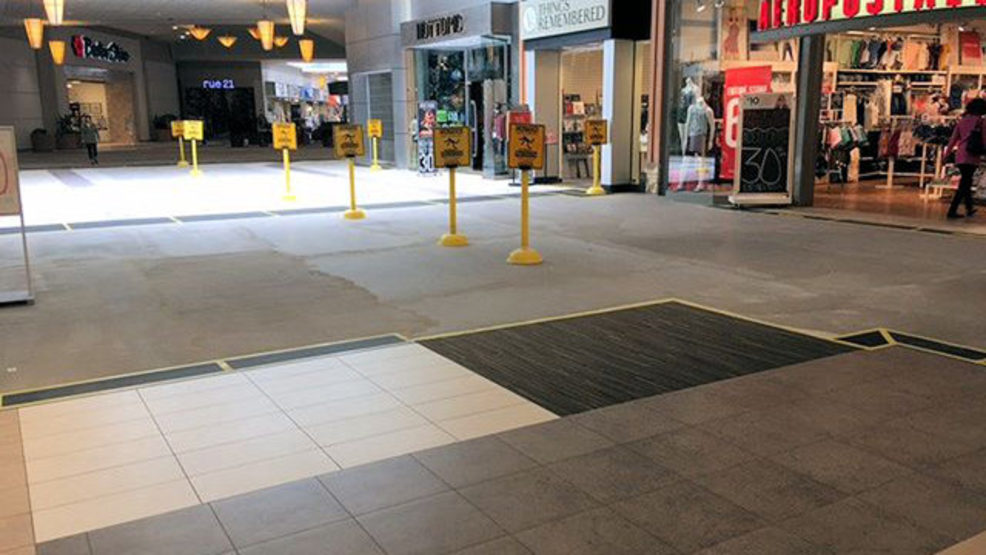
At what (x,y) coordinates should I click in order to perform the action: click on white tiled floor section. Please return your answer as a coordinate pair (x, y). The height and width of the screenshot is (555, 986). Looking at the image, I should click on (97, 415), (107, 499), (254, 472), (215, 388), (318, 374), (372, 443), (514, 416), (410, 362).